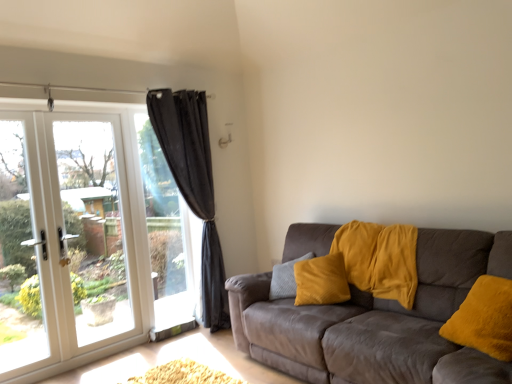
Question: Does velvet brown couch at right have a larger size compared to black curtain at left?

Choices:
 (A) yes
 (B) no

Answer: (A)

Question: Is velvet brown couch at right not within black curtain at left?

Choices:
 (A) no
 (B) yes

Answer: (B)

Question: Is velvet brown couch at right further to the viewer compared to black curtain at left?

Choices:
 (A) yes
 (B) no

Answer: (B)

Question: Is velvet brown couch at right to the right of black curtain at left from the viewer's perspective?

Choices:
 (A) no
 (B) yes

Answer: (B)

Question: From the image's perspective, does velvet brown couch at right appear lower than black curtain at left?

Choices:
 (A) no
 (B) yes

Answer: (B)

Question: From a real-world perspective, relative to white glass door at left, is black sheer curtain at left vertically above or below?

Choices:
 (A) below
 (B) above

Answer: (B)

Question: From the image's perspective, is black sheer curtain at left positioned above or below white glass door at left?

Choices:
 (A) above
 (B) below

Answer: (A)

Question: Looking at their shapes, would you say black sheer curtain at left is wider or thinner than white glass door at left?

Choices:
 (A) wide
 (B) thin

Answer: (A)

Question: Would you say black sheer curtain at left is to the left or to the right of white glass door at left in the picture?

Choices:
 (A) left
 (B) right

Answer: (B)

Question: Is point (334, 314) positioned closer to the camera than point (174, 201)?

Choices:
 (A) farther
 (B) closer

Answer: (B)

Question: From the image's perspective, is velvet brown couch at right positioned above or below black curtain at left?

Choices:
 (A) above
 (B) below

Answer: (B)

Question: From a real-world perspective, is velvet brown couch at right physically located above or below black curtain at left?

Choices:
 (A) below
 (B) above

Answer: (A)

Question: Based on their positions, is velvet brown couch at right located to the left or right of black curtain at left?

Choices:
 (A) left
 (B) right

Answer: (B)

Question: Is black curtain at left wider or thinner than velvet brown couch at right?

Choices:
 (A) wide
 (B) thin

Answer: (B)

Question: Is point (177, 266) positioned closer to the camera than point (353, 347)?

Choices:
 (A) closer
 (B) farther

Answer: (B)